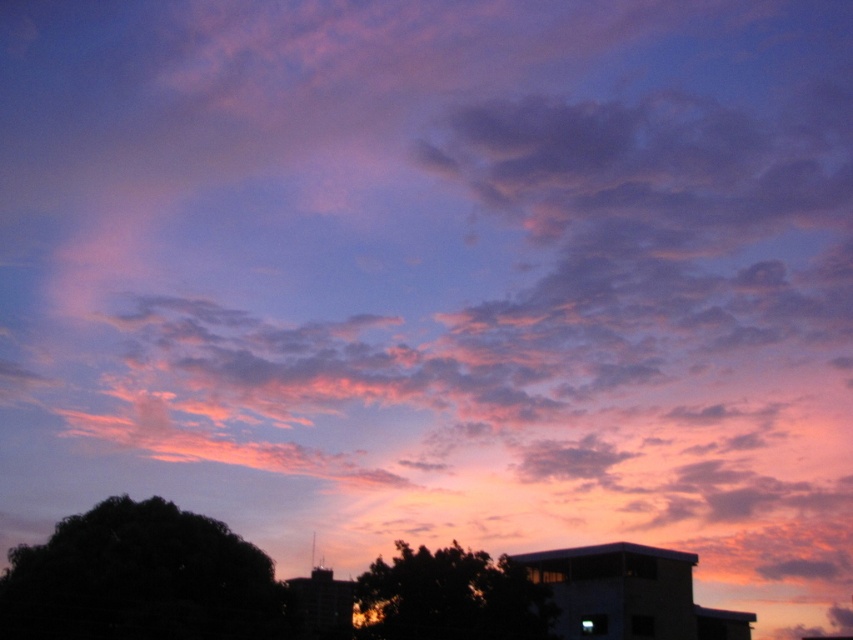
Between point (143, 592) and point (419, 620), which one is positioned behind?

The point (419, 620) is behind.

Is dark green leafy tree at lower left taller than dark green leafy tree at center?

Yes.

Measure the distance between dark green leafy tree at lower left and camera.

47.10 meters

Where is `dark green leafy tree at lower left`? This screenshot has width=853, height=640. dark green leafy tree at lower left is located at coordinates (141, 579).